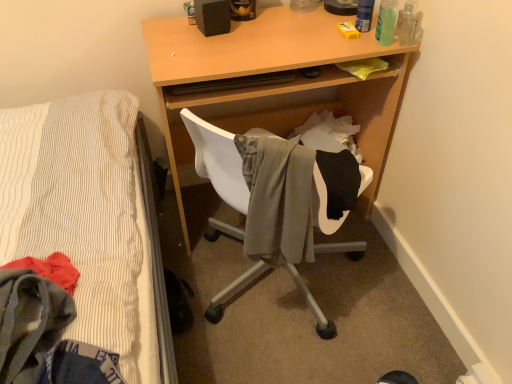
Question: Is green translucent bottle at upper right, arranged as the 2th bottle when viewed from the right, bigger than matte black speaker at upper center?

Choices:
 (A) no
 (B) yes

Answer: (A)

Question: Is green translucent bottle at upper right, which is the second bottle from left to right, thinner than matte black speaker at upper center?

Choices:
 (A) no
 (B) yes

Answer: (B)

Question: Is green translucent bottle at upper right, which is the second bottle from left to right, facing away from matte black speaker at upper center?

Choices:
 (A) yes
 (B) no

Answer: (B)

Question: Is green translucent bottle at upper right, arranged as the 2th bottle when viewed from the right, located outside matte black speaker at upper center?

Choices:
 (A) no
 (B) yes

Answer: (B)

Question: Is matte black speaker at upper center located within green translucent bottle at upper right, arranged as the 2th bottle when viewed from the right?

Choices:
 (A) no
 (B) yes

Answer: (A)

Question: Can you confirm if green translucent bottle at upper right, arranged as the 2th bottle when viewed from the right, is wider than matte black speaker at upper center?

Choices:
 (A) yes
 (B) no

Answer: (B)

Question: From a real-world perspective, does translucent plastic bottle at upper right, the 3th bottle positioned from the right, sit lower than green translucent bottle at upper right, which is the second bottle from left to right?

Choices:
 (A) no
 (B) yes

Answer: (A)

Question: Is translucent plastic bottle at upper right, marked as the 1th bottle in a left-to-right arrangement, at the left side of green translucent bottle at upper right, which is the second bottle from left to right?

Choices:
 (A) yes
 (B) no

Answer: (A)

Question: Is translucent plastic bottle at upper right, the 3th bottle positioned from the right, not close to green translucent bottle at upper right, which is the second bottle from left to right?

Choices:
 (A) yes
 (B) no

Answer: (B)

Question: From the image's perspective, does translucent plastic bottle at upper right, the 3th bottle positioned from the right, appear higher than green translucent bottle at upper right, which is the second bottle from left to right?

Choices:
 (A) no
 (B) yes

Answer: (B)

Question: Can you confirm if translucent plastic bottle at upper right, the 3th bottle positioned from the right, is smaller than green translucent bottle at upper right, arranged as the 2th bottle when viewed from the right?

Choices:
 (A) no
 (B) yes

Answer: (B)

Question: From the image's perspective, is translucent plastic bottle at upper right, the 3th bottle positioned from the right, beneath green translucent bottle at upper right, arranged as the 2th bottle when viewed from the right?

Choices:
 (A) no
 (B) yes

Answer: (A)

Question: Are gray fabric chair at center and green translucent bottle at upper right, arranged as the 2th bottle when viewed from the right, beside each other?

Choices:
 (A) no
 (B) yes

Answer: (A)